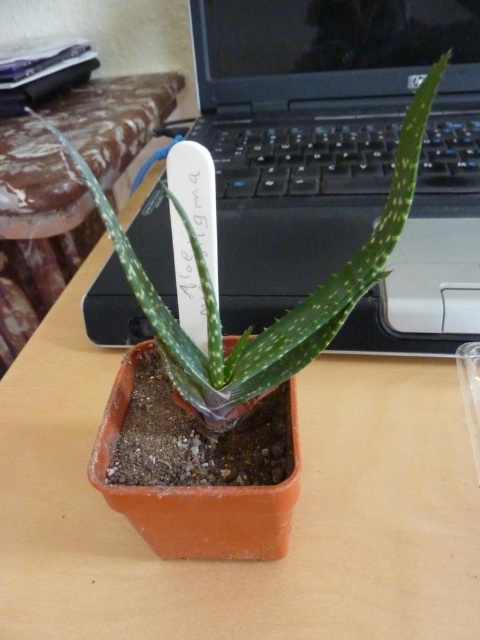
Consider the image. Does black plastic laptop at upper center have a larger size compared to green matte aloe vera at center?

No, black plastic laptop at upper center is not bigger than green matte aloe vera at center.

What do you see at coordinates (342, 160) in the screenshot? I see `black plastic laptop at upper center` at bounding box center [342, 160].

Locate an element on the screen. black plastic laptop at upper center is located at coordinates (342, 160).